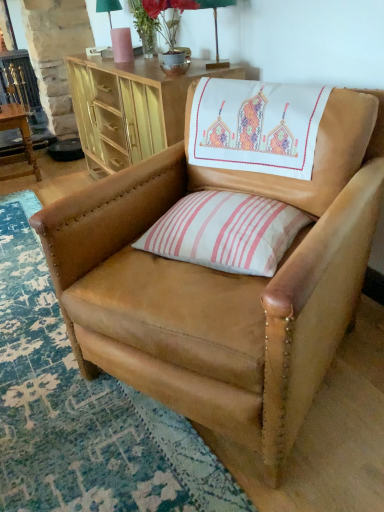
Question: From the image's perspective, is matte gold desk at upper center over green fabric lampshade at upper center, which is counted as the first table lamp, starting from the back?

Choices:
 (A) no
 (B) yes

Answer: (A)

Question: Is matte gold desk at upper center at the left side of green fabric lampshade at upper center, arranged as the 1th table lamp when viewed from the top?

Choices:
 (A) yes
 (B) no

Answer: (B)

Question: Is matte gold desk at upper center facing towards green fabric lampshade at upper center, arranged as the 1th table lamp when viewed from the top?

Choices:
 (A) yes
 (B) no

Answer: (B)

Question: Does matte gold desk at upper center come in front of green fabric lampshade at upper center, acting as the 2th table lamp starting from the bottom?

Choices:
 (A) no
 (B) yes

Answer: (B)

Question: Is matte gold desk at upper center oriented away from green fabric lampshade at upper center, which is counted as the first table lamp, starting from the back?

Choices:
 (A) no
 (B) yes

Answer: (A)

Question: From the image's perspective, is matte gold desk at upper center under green fabric lampshade at upper center, which is counted as the first table lamp, starting from the back?

Choices:
 (A) yes
 (B) no

Answer: (A)

Question: Considering the relative positions of wooden table at lower left and pink striped fabric pillow at center in the image provided, is wooden table at lower left to the left of pink striped fabric pillow at center from the viewer's perspective?

Choices:
 (A) no
 (B) yes

Answer: (B)

Question: Is wooden table at lower left to the right of pink striped fabric pillow at center from the viewer's perspective?

Choices:
 (A) yes
 (B) no

Answer: (B)

Question: From the image's perspective, does wooden table at lower left appear lower than pink striped fabric pillow at center?

Choices:
 (A) no
 (B) yes

Answer: (A)

Question: Does wooden table at lower left have a lesser height compared to pink striped fabric pillow at center?

Choices:
 (A) no
 (B) yes

Answer: (A)

Question: Does wooden table at lower left have a greater width compared to pink striped fabric pillow at center?

Choices:
 (A) no
 (B) yes

Answer: (A)

Question: Considering the relative positions of wooden table at lower left and pink striped fabric pillow at center in the image provided, is wooden table at lower left in front of pink striped fabric pillow at center?

Choices:
 (A) yes
 (B) no

Answer: (B)

Question: Can you confirm if tan leather chair at center is shorter than green fabric table lamp at upper center, the 2th table lamp viewed from the top?

Choices:
 (A) no
 (B) yes

Answer: (A)